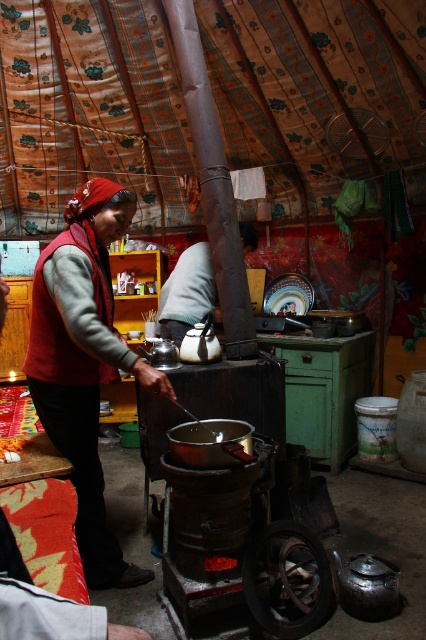
Question: Which point is closer to the camera?

Choices:
 (A) matte black shirt at center
 (B) red woolen vest at center

Answer: (B)

Question: Which of the following is the closest to the observer?

Choices:
 (A) (212, 269)
 (B) (92, 276)

Answer: (B)

Question: Can you confirm if red woolen vest at center is bigger than matte black shirt at center?

Choices:
 (A) yes
 (B) no

Answer: (A)

Question: Does red woolen vest at center have a smaller size compared to matte black shirt at center?

Choices:
 (A) no
 (B) yes

Answer: (A)

Question: Which object appears farthest from the camera in this image?

Choices:
 (A) red woolen vest at center
 (B) matte black shirt at center

Answer: (B)

Question: Can you confirm if red woolen vest at center is bigger than matte black shirt at center?

Choices:
 (A) yes
 (B) no

Answer: (A)